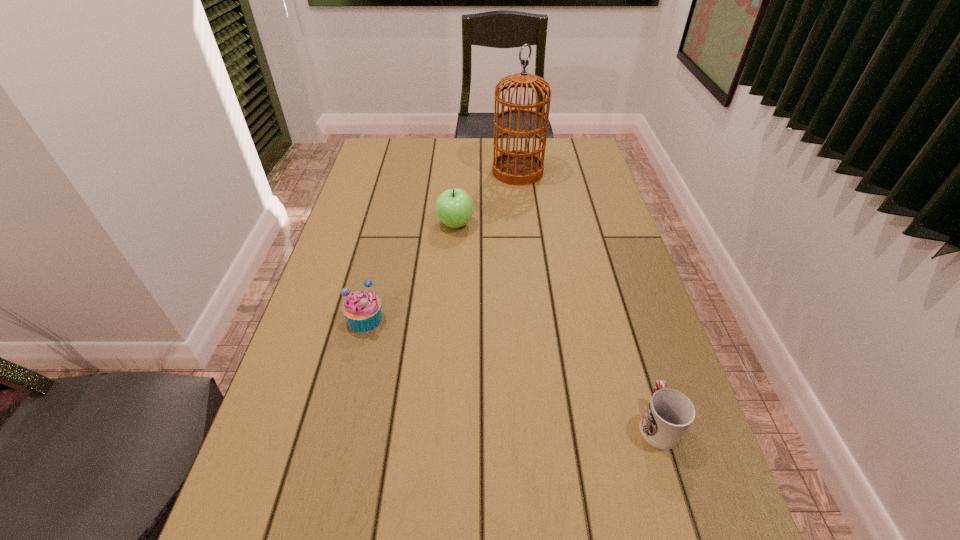
The width and height of the screenshot is (960, 540). I want to click on the tallest object, so tap(516, 167).

This screenshot has height=540, width=960. Find the location of `the second object from right to left`. the second object from right to left is located at coordinates (516, 167).

Locate an element on the screen. the second object from left to right is located at coordinates (454, 208).

This screenshot has width=960, height=540. In order to click on the second farthest object in this screenshot , I will do [454, 208].

At what (x,y) coordinates should I click in order to perform the action: click on the second nearest object. Please return your answer as a coordinate pair (x, y). Image resolution: width=960 pixels, height=540 pixels. Looking at the image, I should click on (362, 309).

Where is `muffin`? muffin is located at coordinates (362, 309).

This screenshot has height=540, width=960. I want to click on the rightmost object, so click(669, 414).

Image resolution: width=960 pixels, height=540 pixels. What are the coordinates of `cup` in the screenshot? It's located at (669, 414).

Locate an element on the screen. The width and height of the screenshot is (960, 540). free location located on the left of the second object from right to left is located at coordinates (452, 172).

The height and width of the screenshot is (540, 960). What are the coordinates of `vacant space located on the right of the third object from right to left` in the screenshot? It's located at (540, 224).